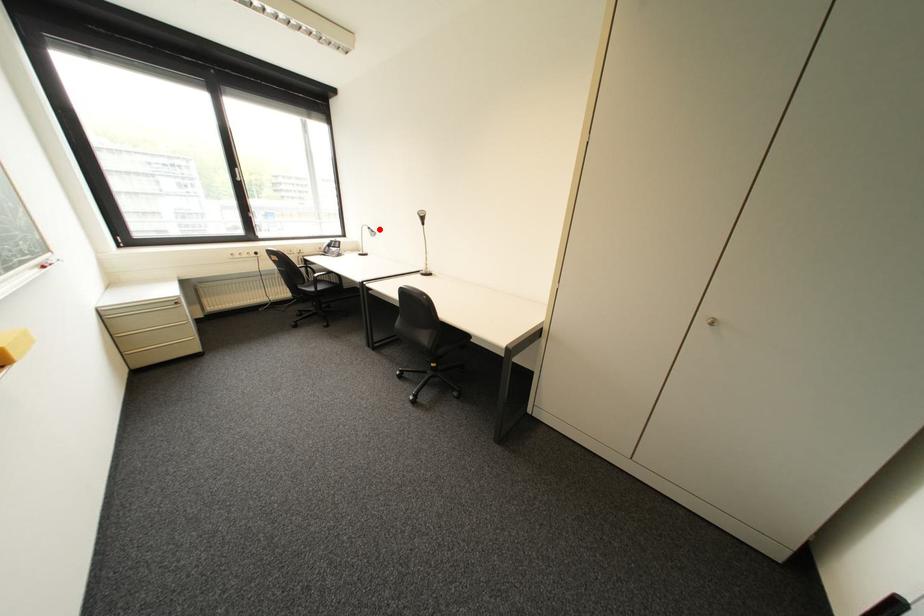
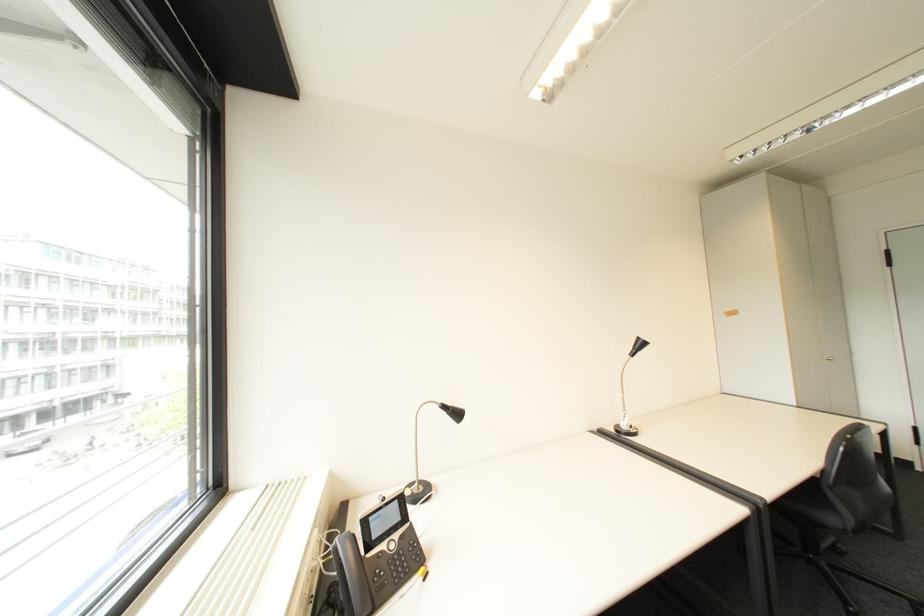
In the second image, find the point that corresponds to the highlighted location in the first image.

(455, 407)